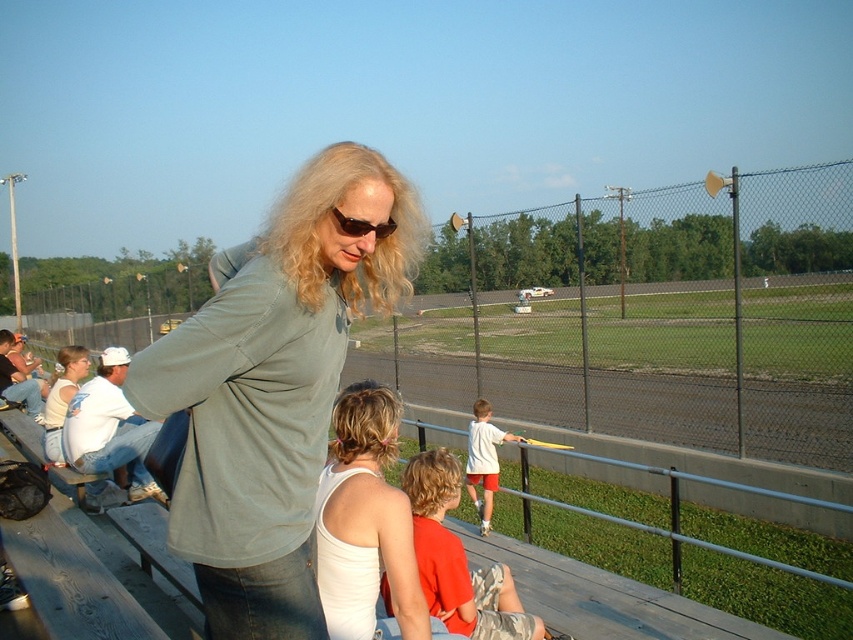
You are a photographer standing at the back of the bleachers and want to take a photo of both the matte green shirt at center and the white matte shirt at center. Which shirt should you focus on first to ensure both are in frame?

The matte green shirt at center is taller than the white matte shirt at center, so you should focus on the matte green shirt at center first to ensure both are in frame.

You are trying to determine which object is bigger between the matte green shirt at center and the matte black sunglasses at center. According to the scene, which one is larger?

The matte green shirt at center is larger than the matte green shirt at center.

You are a photographer trying to capture a photo of the two women sitting on the wooden bleachers at the racetrack. You notice the matte green shirt at center and the white matte shirt at center. Which shirt should you focus on to ensure it fits entirely within your camera frame if your frame can only accommodate the width of the wider shirt?

The matte green shirt at center is wider than the white matte shirt at center, so focusing on the matte green shirt at center ensures it fits entirely within the camera frame.